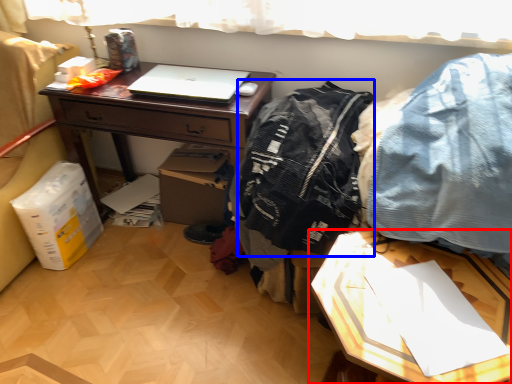
Question: Which of the following is the farthest to the observer, table (highlighted by a red box) or clothing (highlighted by a blue box)?

Choices:
 (A) table
 (B) clothing

Answer: (B)